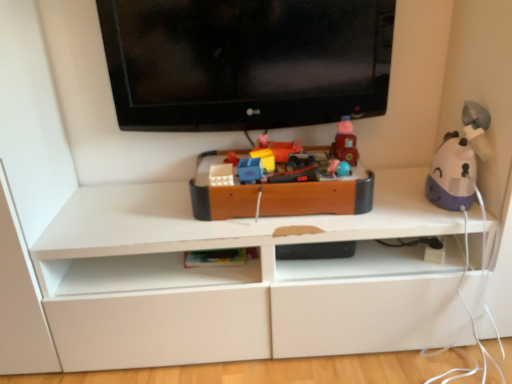
Question: Is matte plastic toy at center, acting as the 5th toy starting from the left, taller than purple matte humidifier at right, the 6th toy from the left?

Choices:
 (A) no
 (B) yes

Answer: (A)

Question: Considering the relative positions of matte plastic toy at center, acting as the 5th toy starting from the left, and purple matte humidifier at right, acting as the 1th toy starting from the right, in the image provided, is matte plastic toy at center, acting as the 5th toy starting from the left, to the right of purple matte humidifier at right, acting as the 1th toy starting from the right, from the viewer's perspective?

Choices:
 (A) no
 (B) yes

Answer: (A)

Question: Considering the relative sizes of matte plastic toy at center, the second toy positioned from the right, and purple matte humidifier at right, acting as the 1th toy starting from the right, in the image provided, is matte plastic toy at center, the second toy positioned from the right, thinner than purple matte humidifier at right, acting as the 1th toy starting from the right,?

Choices:
 (A) no
 (B) yes

Answer: (B)

Question: Considering the relative sizes of matte plastic toy at center, the second toy positioned from the right, and purple matte humidifier at right, the 6th toy from the left, in the image provided, is matte plastic toy at center, the second toy positioned from the right, smaller than purple matte humidifier at right, the 6th toy from the left,?

Choices:
 (A) yes
 (B) no

Answer: (A)

Question: Does matte plastic toy at center, acting as the 5th toy starting from the left, appear on the left side of purple matte humidifier at right, acting as the 1th toy starting from the right?

Choices:
 (A) yes
 (B) no

Answer: (A)

Question: Is matte plastic toy at center, which is the 6th toy in right-to-left order, bigger or smaller than blue plastic toy at center, positioned as the fifth toy in right-to-left order?

Choices:
 (A) small
 (B) big

Answer: (A)

Question: Considering the positions of point (236, 157) and point (245, 168), is point (236, 157) closer or farther from the camera than point (245, 168)?

Choices:
 (A) closer
 (B) farther

Answer: (B)

Question: Visually, is matte plastic toy at center, which is counted as the 1th toy, starting from the left, positioned to the left or to the right of blue plastic toy at center, positioned as the fifth toy in right-to-left order?

Choices:
 (A) right
 (B) left

Answer: (B)

Question: From a real-world perspective, is matte plastic toy at center, which is the 6th toy in right-to-left order, positioned above or below blue plastic toy at center, positioned as the fifth toy in right-to-left order?

Choices:
 (A) above
 (B) below

Answer: (A)

Question: Is black glossy tv at upper center situated inside blue plastic toy at center, positioned as the fifth toy in right-to-left order, or outside?

Choices:
 (A) inside
 (B) outside

Answer: (B)

Question: From the image's perspective, is black glossy tv at upper center located above or below blue plastic toy at center, positioned as the fifth toy in right-to-left order?

Choices:
 (A) below
 (B) above

Answer: (B)

Question: Considering the relative positions of black glossy tv at upper center and blue plastic toy at center, positioned as the fifth toy in right-to-left order, in the image provided, is black glossy tv at upper center to the left or to the right of blue plastic toy at center, positioned as the fifth toy in right-to-left order,?

Choices:
 (A) left
 (B) right

Answer: (B)

Question: From their relative heights in the image, would you say black glossy tv at upper center is taller or shorter than blue plastic toy at center, positioned as the fifth toy in right-to-left order?

Choices:
 (A) tall
 (B) short

Answer: (A)

Question: Considering the positions of point (253, 148) and point (296, 185), is point (253, 148) closer or farther from the camera than point (296, 185)?

Choices:
 (A) closer
 (B) farther

Answer: (B)

Question: From the image's perspective, is matte plastic toy car at center, the 3th toy positioned from the left, positioned above or below wooden toy train at center, which appears as the 4th toy when viewed from the left?

Choices:
 (A) below
 (B) above

Answer: (B)